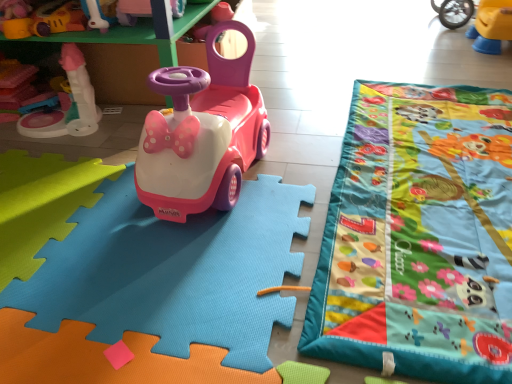
The image size is (512, 384). I want to click on matte plastic toy car at upper center, positioned as the 4th toy in bottom-to-top order, so click(x=132, y=11).

Find the location of a particular element. Image resolution: width=512 pixels, height=384 pixels. pink plastic toy car at center is located at coordinates (202, 134).

Who is shorter, pink plastic toy car at center or multicolored fabric play mat at right?

Standing shorter between the two is multicolored fabric play mat at right.

Between pink plastic toy car at center and multicolored fabric play mat at right, which one has larger size?

pink plastic toy car at center.

Is pink plastic toy car at center wider or thinner than multicolored fabric play mat at right?

Considering their sizes, pink plastic toy car at center looks slimmer than multicolored fabric play mat at right.

Which is behind, pink plastic toy car at center or multicolored fabric play mat at right?

pink plastic toy car at center.

Between pink plastic toy car at center, the 1th toy viewed from the top, and matte plastic toy at upper left, the third toy from the top, which one has smaller size?

With smaller size is matte plastic toy at upper left, the third toy from the top.

Considering the positions of objects pink plastic toy car at center, the 1th toy viewed from the top, and matte plastic toy at upper left, the third toy from the top, in the image provided, who is more to the left, pink plastic toy car at center, the 1th toy viewed from the top, or matte plastic toy at upper left, the third toy from the top,?

Positioned to the left is matte plastic toy at upper left, the third toy from the top.

Is there a large distance between pink plastic toy car at center, the 1th toy viewed from the top, and matte plastic toy at upper left, acting as the 3th toy starting from the bottom?

Actually, pink plastic toy car at center, the 1th toy viewed from the top, and matte plastic toy at upper left, acting as the 3th toy starting from the bottom, are a little close together.

Considering the points (137, 29) and (35, 36), which point is behind, point (137, 29) or point (35, 36)?

The point (35, 36) is farther.

Is matte plastic toy at upper left, the third toy from the top, far away from pink plastic toy car at center?

They are positioned close to each other.

Locate an element on the screen. The width and height of the screenshot is (512, 384). toy car that appears below the matte plastic toy at upper left, the third toy from the top (from the image's perspective) is located at coordinates (202, 134).

Could you tell me if matte plastic toy at upper left, the third toy from the top, is turned towards pink plastic toy car at center?

No, matte plastic toy at upper left, the third toy from the top, does not turn towards pink plastic toy car at center.

Looking at this image, is matte plastic toy at upper left, the third toy from the top, located outside pink plastic toy car at center?

matte plastic toy at upper left, the third toy from the top, is positioned outside pink plastic toy car at center.

Is pink plastic car at center, which is the 5th toy in top-to-bottom order, at the back of matte plastic toy at upper left, acting as the 3th toy starting from the bottom?

matte plastic toy at upper left, acting as the 3th toy starting from the bottom, does not have its back to pink plastic car at center, which is the 5th toy in top-to-bottom order.

From the picture: Is matte plastic toy at upper left, the third toy from the top, touching pink plastic car at center, which is the 5th toy in top-to-bottom order?

There is a gap between matte plastic toy at upper left, the third toy from the top, and pink plastic car at center, which is the 5th toy in top-to-bottom order.

Relative to pink plastic car at center, the 1th toy ordered from the bottom, is matte plastic toy at upper left, the third toy from the top, in front or behind?

In the image, matte plastic toy at upper left, the third toy from the top, appears behind pink plastic car at center, the 1th toy ordered from the bottom.

From a real-world perspective, who is located higher, matte plastic toy at upper left, the third toy from the top, or pink plastic car at center, the 1th toy ordered from the bottom?

In real-world perspective, matte plastic toy at upper left, the third toy from the top, is above.

Is pink plastic car at center, the 1th toy ordered from the bottom, located outside matte plastic toy car at upper center, positioned as the 4th toy in bottom-to-top order?

Indeed, pink plastic car at center, the 1th toy ordered from the bottom, is completely outside matte plastic toy car at upper center, positioned as the 4th toy in bottom-to-top order.

Could you measure the distance between pink plastic car at center, which is the 5th toy in top-to-bottom order, and matte plastic toy car at upper center, positioned as the 4th toy in bottom-to-top order?

The distance of pink plastic car at center, which is the 5th toy in top-to-bottom order, from matte plastic toy car at upper center, positioned as the 4th toy in bottom-to-top order, is 82.60 centimeters.

From a real-world perspective, is pink plastic car at center, the 1th toy ordered from the bottom, beneath matte plastic toy car at upper center, positioned as the 4th toy in bottom-to-top order?

Correct, in the physical world, pink plastic car at center, the 1th toy ordered from the bottom, is lower than matte plastic toy car at upper center, positioned as the 4th toy in bottom-to-top order.

The width and height of the screenshot is (512, 384). What are the coordinates of `the 2nd toy in front of the matte plastic toy car at upper center, positioned as the 4th toy in bottom-to-top order` in the screenshot? It's located at (139, 278).

Is pink plastic car at center, the 1th toy ordered from the bottom, positioned behind matte plastic toy at left, the fourth toy when ordered from top to bottom?

No, it is not.

From the image's perspective, is pink plastic car at center, which is the 5th toy in top-to-bottom order, above or below matte plastic toy at left, placed as the 2th toy when sorted from bottom to top?

pink plastic car at center, which is the 5th toy in top-to-bottom order, is below matte plastic toy at left, placed as the 2th toy when sorted from bottom to top.

What's the angular difference between pink plastic car at center, which is the 5th toy in top-to-bottom order, and matte plastic toy at left, the fourth toy when ordered from top to bottom,'s facing directions?

180 degrees separate the facing orientations of pink plastic car at center, which is the 5th toy in top-to-bottom order, and matte plastic toy at left, the fourth toy when ordered from top to bottom.

Considering the sizes of objects pink plastic car at center, the 1th toy ordered from the bottom, and matte plastic toy at left, placed as the 2th toy when sorted from bottom to top, in the image provided, who is shorter, pink plastic car at center, the 1th toy ordered from the bottom, or matte plastic toy at left, placed as the 2th toy when sorted from bottom to top,?

pink plastic car at center, the 1th toy ordered from the bottom, is shorter.

Does matte plastic toy at left, placed as the 2th toy when sorted from bottom to top, have a smaller size compared to multicolored fabric play mat at right?

Actually, matte plastic toy at left, placed as the 2th toy when sorted from bottom to top, might be larger than multicolored fabric play mat at right.

Would you say multicolored fabric play mat at right is part of matte plastic toy at left, placed as the 2th toy when sorted from bottom to top,'s contents?

No.

Between matte plastic toy at left, the fourth toy when ordered from top to bottom, and multicolored fabric play mat at right, which one has smaller width?

Thinner between the two is matte plastic toy at left, the fourth toy when ordered from top to bottom.

From the image's perspective, who appears lower, matte plastic toy at left, placed as the 2th toy when sorted from bottom to top, or multicolored fabric play mat at right?

multicolored fabric play mat at right, from the image's perspective.

Where is `toy car to the left of multicolored fabric play mat at right`? This screenshot has width=512, height=384. toy car to the left of multicolored fabric play mat at right is located at coordinates (202, 134).

There is a matte plastic toy at upper left, acting as the 3th toy starting from the bottom. Identify the location of the 1st toy below it (from a real-world perspective). (x=139, y=32).

Which object lies further to the anchor point pink plastic car at center, which is the 5th toy in top-to-bottom order, matte plastic toy car at upper center, the second toy positioned from the top, or pink plastic toy car at center, arranged as the fifth toy when ordered from the bottom?

matte plastic toy car at upper center, the second toy positioned from the top, is positioned further to the anchor pink plastic car at center, which is the 5th toy in top-to-bottom order.

Estimate the real-world distances between objects in this image. Which object is further from matte plastic toy at upper left, acting as the 3th toy starting from the bottom, pink plastic toy car at center or pink plastic car at center, the 1th toy ordered from the bottom?

Based on the image, pink plastic car at center, the 1th toy ordered from the bottom, appears to be further to matte plastic toy at upper left, acting as the 3th toy starting from the bottom.

Based on their spatial positions, is matte plastic toy at left, the fourth toy when ordered from top to bottom, or pink plastic toy car at center closer to pink plastic car at center, which is the 5th toy in top-to-bottom order?

Among the two, pink plastic toy car at center is located nearer to pink plastic car at center, which is the 5th toy in top-to-bottom order.

From the image, which object appears to be nearer to matte plastic toy at upper left, acting as the 3th toy starting from the bottom, matte plastic toy car at upper center, positioned as the 4th toy in bottom-to-top order, or multicolored fabric play mat at right?

matte plastic toy car at upper center, positioned as the 4th toy in bottom-to-top order.

Considering their positions, is matte plastic toy car at upper center, positioned as the 4th toy in bottom-to-top order, positioned closer to pink plastic toy car at center than pink plastic car at center, which is the 5th toy in top-to-bottom order?

Among the two, pink plastic car at center, which is the 5th toy in top-to-bottom order, is located nearer to pink plastic toy car at center.

Based on their spatial positions, is matte plastic toy at upper left, the third toy from the top, or multicolored fabric play mat at right further from matte plastic toy at left, placed as the 2th toy when sorted from bottom to top?

The object further to matte plastic toy at left, placed as the 2th toy when sorted from bottom to top, is multicolored fabric play mat at right.

Estimate the real-world distances between objects in this image. Which object is further from pink plastic car at center, which is the 5th toy in top-to-bottom order, multicolored fabric play mat at right or matte plastic toy car at upper center, the second toy positioned from the top?

matte plastic toy car at upper center, the second toy positioned from the top, lies further to pink plastic car at center, which is the 5th toy in top-to-bottom order, than the other object.

From the image, which object appears to be farther from matte plastic toy car at upper center, positioned as the 4th toy in bottom-to-top order, pink plastic toy car at center or matte plastic toy at left, the fourth toy when ordered from top to bottom?

Among the two, pink plastic toy car at center is located further to matte plastic toy car at upper center, positioned as the 4th toy in bottom-to-top order.

Where is `toy car positioned between multicolored fabric play mat at right and pink plastic toy car at center, arranged as the fifth toy when ordered from the bottom, from near to far`? This screenshot has height=384, width=512. toy car positioned between multicolored fabric play mat at right and pink plastic toy car at center, arranged as the fifth toy when ordered from the bottom, from near to far is located at coordinates (202, 134).

Find the location of a particular element. This screenshot has height=384, width=512. toy car between matte plastic toy car at upper center, the second toy positioned from the top, and pink plastic car at center, which is the 5th toy in top-to-bottom order, vertically is located at coordinates (202, 134).

The height and width of the screenshot is (384, 512). Identify the location of toy car between pink plastic car at center, the 1th toy ordered from the bottom, and pink plastic toy car at center, the 1th toy viewed from the top, in the front-back direction. (202, 134).

You are a GUI agent. You are given a task and a screenshot of the screen. Output one action in this format:
    pyautogui.click(x=<x>, y=<y>)
    Task: Click on the toy situated between matte plastic toy at upper left, acting as the 3th toy starting from the bottom, and pink plastic toy car at center, the 1th toy viewed from the top, from left to right
    The image size is (512, 384).
    Given the screenshot: What is the action you would take?
    pyautogui.click(x=132, y=11)